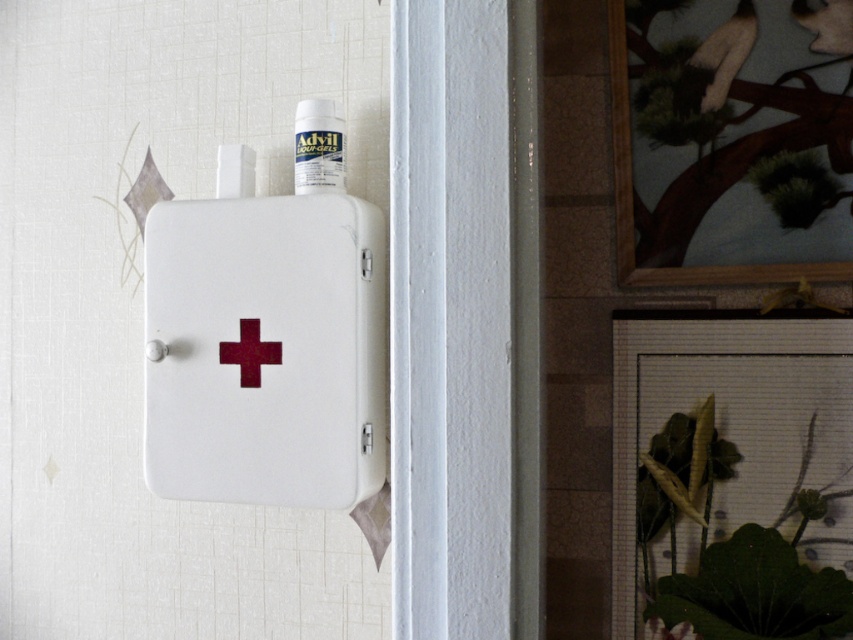
Question: Does white matte first aid box at center come behind maroon matte cross at center?

Choices:
 (A) no
 (B) yes

Answer: (A)

Question: Is white plastic bottle at upper center closer to camera compared to maroon matte cross at center?

Choices:
 (A) yes
 (B) no

Answer: (B)

Question: Which of the following is the closest to the observer?

Choices:
 (A) white matte first aid box at center
 (B) white plastic bottle at upper center

Answer: (A)

Question: Which object is the farthest from the maroon matte cross at center?

Choices:
 (A) white plastic bottle at upper center
 (B) white matte first aid box at center

Answer: (A)

Question: Is white matte first aid box at center smaller than maroon matte cross at center?

Choices:
 (A) yes
 (B) no

Answer: (B)

Question: Which of these objects is positioned closest to the white plastic bottle at upper center?

Choices:
 (A) maroon matte cross at center
 (B) white matte first aid box at center

Answer: (B)